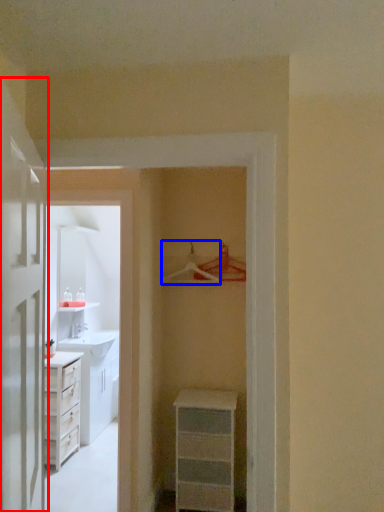
Question: Among these objects, which one is nearest to the camera, door (highlighted by a red box) or hanger (highlighted by a blue box)?

Choices:
 (A) door
 (B) hanger

Answer: (A)